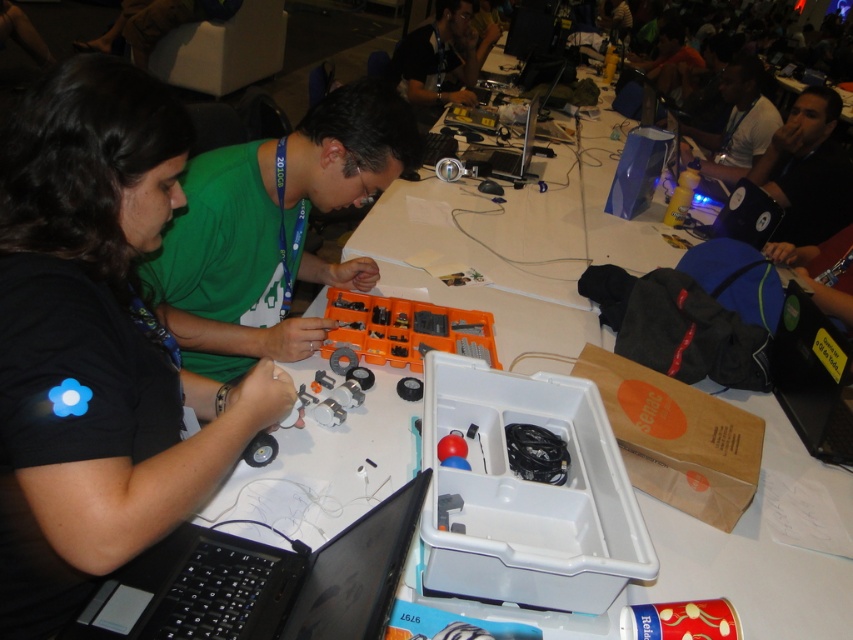
Question: Is black fabric shirt at upper right wider than satin black laptop at center?

Choices:
 (A) yes
 (B) no

Answer: (A)

Question: Which object appears closest to the camera in this image?

Choices:
 (A) matte black laptop at upper right
 (B) black plastic laptop at upper right

Answer: (B)

Question: Which of these objects is positioned closest to the black matte shirt at left?

Choices:
 (A) black plastic computer at lower right
 (B) black fabric shirt at upper right
 (C) black matte laptop at lower left

Answer: (C)

Question: Is black matte laptop at lower left in front of black plastic computer at lower right?

Choices:
 (A) no
 (B) yes

Answer: (B)

Question: Is black fabric shirt at upper right bigger than matte black shirt at upper center?

Choices:
 (A) no
 (B) yes

Answer: (A)

Question: Based on their relative distances, which object is nearer to the black plastic computer at lower right?

Choices:
 (A) green fabric shirt at upper left
 (B) matte black laptop at upper right
 (C) black fabric shirt at upper right

Answer: (C)